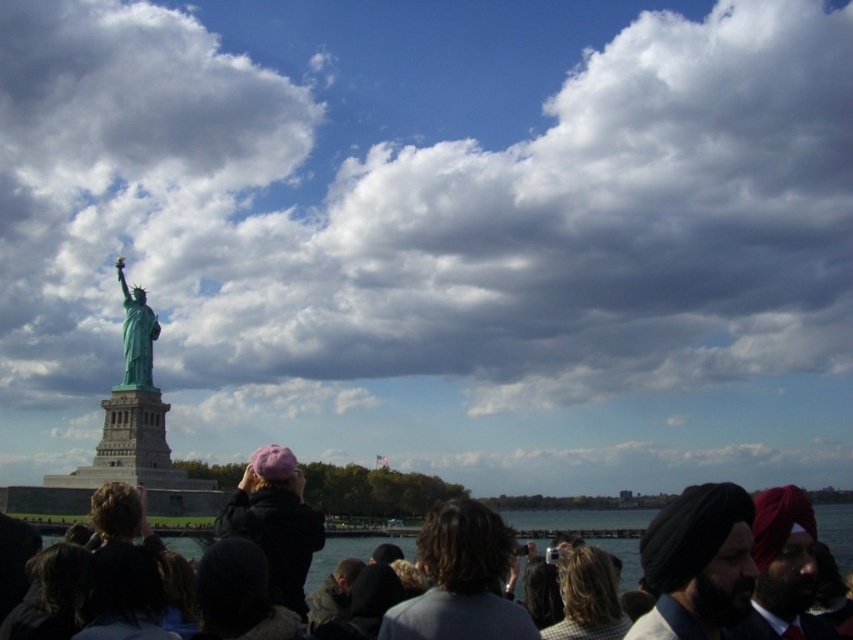
Question: Considering the real-world distances, which object is farthest from the cloudy sky at upper center?

Choices:
 (A) pink fabric hat at upper center
 (B) black turban at lower right

Answer: (B)

Question: Is cloudy sky at upper center thinner than black turban at lower right?

Choices:
 (A) no
 (B) yes

Answer: (A)

Question: Which point is closer to the camera taking this photo?

Choices:
 (A) coord(715,589)
 (B) coord(756,275)

Answer: (A)

Question: Can you confirm if purple woolen hat at center is thinner than green patina statue at center?

Choices:
 (A) yes
 (B) no

Answer: (B)

Question: Does black turban at lower right have a lesser width compared to purple woolen hat at center?

Choices:
 (A) no
 (B) yes

Answer: (A)

Question: Which point is farther from the camera taking this photo?

Choices:
 (A) (245, 493)
 (B) (828, 536)
 (C) (229, 134)
 (D) (136, 300)

Answer: (C)